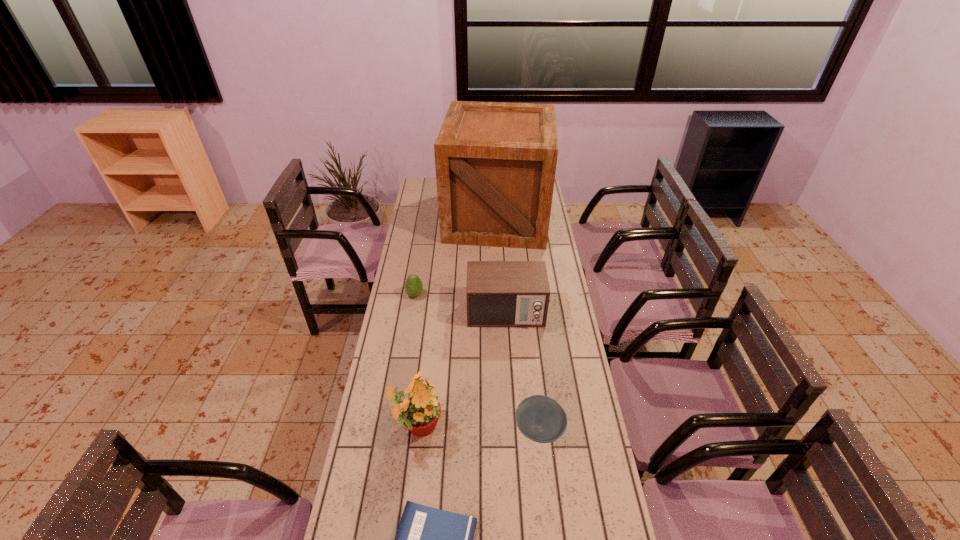
This screenshot has height=540, width=960. Identify the location of blank space that satisfies the following two spatial constraints: 1. on the front-facing side of the radio receiver; 2. on the right side of the second shortest object. (513, 429).